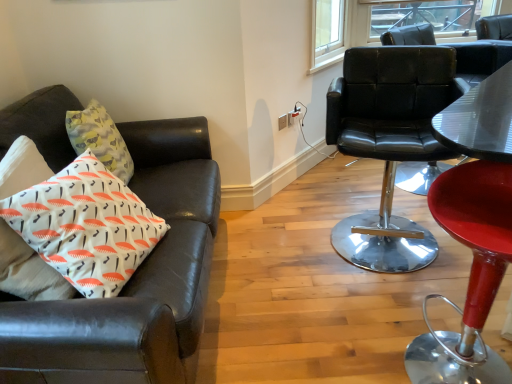
Question: Can you see leather couch at left, acting as the 1th chair starting from the left, touching black leather chair at right, marked as the 2th chair in a right-to-left arrangement?

Choices:
 (A) no
 (B) yes

Answer: (A)

Question: Is the position of leather couch at left, arranged as the third chair when viewed from the right, more distant than that of black leather chair at right, marked as the 2th chair in a right-to-left arrangement?

Choices:
 (A) no
 (B) yes

Answer: (A)

Question: Could you tell me if leather couch at left, acting as the 1th chair starting from the left, is turned towards black leather chair at right, marked as the 2th chair in a right-to-left arrangement?

Choices:
 (A) no
 (B) yes

Answer: (B)

Question: Does leather couch at left, acting as the 1th chair starting from the left, have a greater width compared to black leather chair at right, which is the second chair in left-to-right order?

Choices:
 (A) no
 (B) yes

Answer: (B)

Question: Can you confirm if leather couch at left, acting as the 1th chair starting from the left, is bigger than black leather chair at right, marked as the 2th chair in a right-to-left arrangement?

Choices:
 (A) yes
 (B) no

Answer: (A)

Question: Can we say leather couch at left, acting as the 1th chair starting from the left, lies outside black leather chair at right, marked as the 2th chair in a right-to-left arrangement?

Choices:
 (A) yes
 (B) no

Answer: (A)

Question: Can you confirm if black leather chair at right, marked as the 2th chair in a right-to-left arrangement, is positioned to the left of white plastic power outlet at upper center?

Choices:
 (A) no
 (B) yes

Answer: (A)

Question: Is black leather chair at right, which is the second chair in left-to-right order, in front of white plastic power outlet at upper center?

Choices:
 (A) yes
 (B) no

Answer: (A)

Question: Is black leather chair at right, which is the second chair in left-to-right order, oriented towards white plastic power outlet at upper center?

Choices:
 (A) yes
 (B) no

Answer: (B)

Question: Does black leather chair at right, which is the second chair in left-to-right order, have a smaller size compared to white plastic power outlet at upper center?

Choices:
 (A) no
 (B) yes

Answer: (A)

Question: Does black leather chair at right, marked as the 2th chair in a right-to-left arrangement, have a greater width compared to white plastic power outlet at upper center?

Choices:
 (A) yes
 (B) no

Answer: (A)

Question: Would you say black leather chair at right, marked as the 2th chair in a right-to-left arrangement, contains white plastic power outlet at upper center?

Choices:
 (A) yes
 (B) no

Answer: (B)

Question: From a real-world perspective, is clear glass window at upper right on leather couch at left, arranged as the third chair when viewed from the right?

Choices:
 (A) yes
 (B) no

Answer: (A)